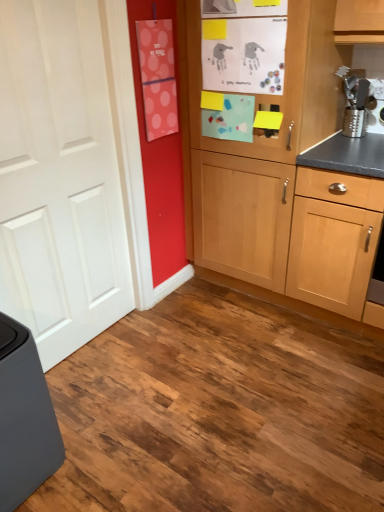
Locate an element on the screen. The image size is (384, 512). matte gray trash can at lower left is located at coordinates (24, 418).

Can you confirm if white matte door at left is positioned to the left of metallic silver grater at upper right?

Correct, you'll find white matte door at left to the left of metallic silver grater at upper right.

Is white matte door at left bigger than metallic silver grater at upper right?

Yes.

Consider the image. Looking at their sizes, would you say white matte door at left is wider or thinner than metallic silver grater at upper right?

Clearly, white matte door at left has less width compared to metallic silver grater at upper right.

Based on the photo, from the image's perspective, between metallic silver grater at upper right and white matte door at left, which one is located above?

From the image's view, metallic silver grater at upper right is above.

Considering the sizes of objects metallic silver grater at upper right and white matte door at left in the image provided, who is wider, metallic silver grater at upper right or white matte door at left?

With larger width is metallic silver grater at upper right.

Which is behind, metallic silver grater at upper right or white matte door at left?

metallic silver grater at upper right is further away from the camera.

Choose the correct answer: Is metallic silver grater at upper right inside white matte door at left or outside it?

metallic silver grater at upper right is not inside white matte door at left, it's outside.

Considering the relative sizes of light wood cabinet at center and matte gray trash can at lower left in the image provided, is light wood cabinet at center shorter than matte gray trash can at lower left?

Incorrect, the height of light wood cabinet at center does not fall short of that of matte gray trash can at lower left.

From a real-world perspective, which object stands above the other?

light wood cabinet at center.

Considering the relative sizes of light wood cabinet at center and matte gray trash can at lower left in the image provided, is light wood cabinet at center wider than matte gray trash can at lower left?

Correct, the width of light wood cabinet at center exceeds that of matte gray trash can at lower left.

Does light wood cabinet at center turn towards matte gray trash can at lower left?

Yes, light wood cabinet at center is aimed at matte gray trash can at lower left.

Is point (26, 451) positioned in front of point (45, 140)?

Yes, point (26, 451) is in front of point (45, 140).

Is white matte door at left surrounded by matte gray trash can at lower left?

Actually, white matte door at left is outside matte gray trash can at lower left.

Who is shorter, matte gray trash can at lower left or white matte door at left?

matte gray trash can at lower left is shorter.

How much distance is there between matte gray trash can at lower left and white matte door at left?

matte gray trash can at lower left and white matte door at left are 25.62 inches apart from each other.

Do you think light wood cabinet at center is within metallic silver grater at upper right, or outside of it?

light wood cabinet at center is outside metallic silver grater at upper right.

Is light wood cabinet at center with metallic silver grater at upper right?

No, light wood cabinet at center is not in contact with metallic silver grater at upper right.

Considering the sizes of light wood cabinet at center and metallic silver grater at upper right in the image, is light wood cabinet at center taller or shorter than metallic silver grater at upper right?

light wood cabinet at center is taller than metallic silver grater at upper right.

Consider the image. What's the angular difference between light wood cabinet at center and metallic silver grater at upper right's facing directions?

There is a 6.49-degree angle between the facing directions of light wood cabinet at center and metallic silver grater at upper right.

Is white matte door at left turned away from matte gray trash can at lower left?

white matte door at left is not turned away from matte gray trash can at lower left.

From the image's perspective, which one is positioned lower, white matte door at left or matte gray trash can at lower left?

From the image's view, matte gray trash can at lower left is below.

Consider the image. Is matte gray trash can at lower left inside white matte door at left?

No.

From the image's perspective, is metallic silver grater at upper right on top of light wood cabinet at center?

Correct, metallic silver grater at upper right appears higher than light wood cabinet at center in the image.

Who is bigger, metallic silver grater at upper right or light wood cabinet at center?

Bigger between the two is light wood cabinet at center.

Which object is thinner, metallic silver grater at upper right or light wood cabinet at center?

Thinner between the two is metallic silver grater at upper right.

Find the location of `door below the metallic silver grater at upper right (from the image's perspective)`. door below the metallic silver grater at upper right (from the image's perspective) is located at coordinates (59, 176).

Locate an element on the screen. This screenshot has width=384, height=512. appliance above the white matte door at left (from a real-world perspective) is located at coordinates [355, 122].

Which object lies nearer to the anchor point light wood cabinet at center, matte gray trash can at lower left or white matte door at left?

white matte door at left is positioned closer to the anchor light wood cabinet at center.

Looking at this image, based on their spatial positions, is metallic silver grater at upper right or matte gray trash can at lower left further from light wood cabinet at center?

matte gray trash can at lower left.

Based on the photo, based on their spatial positions, is light wood cabinet at center or matte gray trash can at lower left closer to metallic silver grater at upper right?

light wood cabinet at center lies closer to metallic silver grater at upper right than the other object.

Which object lies further to the anchor point light wood cabinet at center, matte gray trash can at lower left or metallic silver grater at upper right?

matte gray trash can at lower left.

Estimate the real-world distances between objects in this image. Which object is further from light wood cabinet at center, metallic silver grater at upper right or white matte door at left?

The object further to light wood cabinet at center is white matte door at left.

Based on their spatial positions, is metallic silver grater at upper right or light wood cabinet at center further from white matte door at left?

metallic silver grater at upper right is positioned further to the anchor white matte door at left.

Considering their positions, is matte gray trash can at lower left positioned further to white matte door at left than light wood cabinet at center?

The object further to white matte door at left is light wood cabinet at center.

Which object lies nearer to the anchor point matte gray trash can at lower left, light wood cabinet at center or white matte door at left?

white matte door at left lies closer to matte gray trash can at lower left than the other object.

Find the location of a particular element. cabinetry between white matte door at left and metallic silver grater at upper right in the horizontal direction is located at coordinates point(285,176).

Find the location of a particular element. This screenshot has width=384, height=512. cabinetry located between matte gray trash can at lower left and metallic silver grater at upper right in the left-right direction is located at coordinates coord(285,176).

You are a GUI agent. You are given a task and a screenshot of the screen. Output one action in this format:
    pyautogui.click(x=<x>, y=<y>)
    Task: Click on the door between matte gray trash can at lower left and metallic silver grater at upper right in the horizontal direction
    The image size is (384, 512).
    Given the screenshot: What is the action you would take?
    pyautogui.click(x=59, y=176)

Identify the location of door located between matte gray trash can at lower left and light wood cabinet at center in the left-right direction. (59, 176).